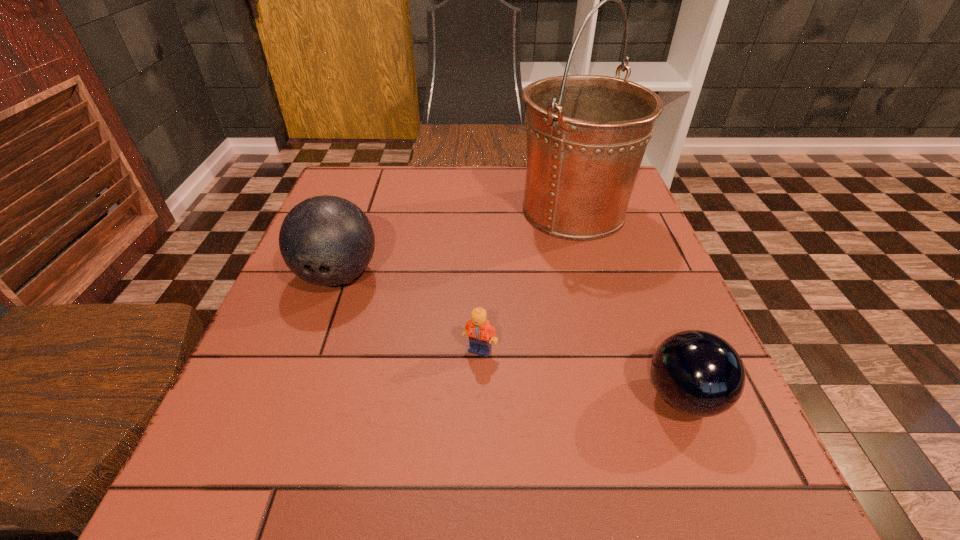
The width and height of the screenshot is (960, 540). Identify the location of vacant area at the near edge of the desktop. (321, 496).

Identify the location of free region at the left edge of the desktop. (302, 403).

Locate an element on the screen. This screenshot has width=960, height=540. vacant space at the right edge of the desktop is located at coordinates (660, 247).

This screenshot has width=960, height=540. In the image, there is a desktop. Find the location of `free region at the far left corner`. free region at the far left corner is located at coordinates (359, 175).

The image size is (960, 540). In order to click on blank space at the near right corner of the desktop in this screenshot , I will do `click(782, 498)`.

I want to click on vacant space that's between the nearest object and the shortest object, so click(x=582, y=374).

Find the location of a particular element. The width and height of the screenshot is (960, 540). free space between the Lego and the bucket is located at coordinates (527, 280).

The width and height of the screenshot is (960, 540). Identify the location of free point between the second nearest object and the bucket. (527, 280).

Locate an element on the screen. The image size is (960, 540). vacant area between the shortest object and the right bowling ball is located at coordinates (582, 374).

Image resolution: width=960 pixels, height=540 pixels. In order to click on free space between the taller bowling ball and the nearer bowling ball in this screenshot , I will do [x=511, y=336].